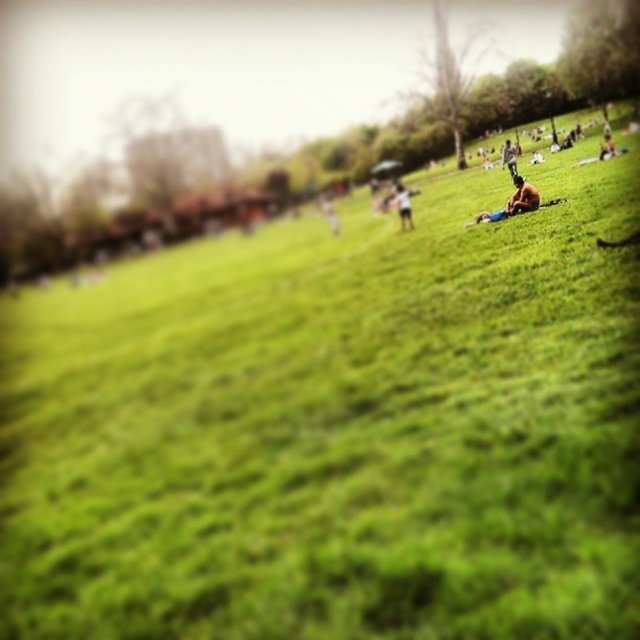
Question: Among these objects, which one is farthest from the camera?

Choices:
 (A) brown skin person at center
 (B) light blue jeans at center
 (C) smooth skin person at upper right
 (D) shiny metallic helmet at upper right

Answer: (D)

Question: Which point is farther from the camera taking this photo?

Choices:
 (A) (515, 173)
 (B) (513, 173)
 (C) (403, 188)
 (D) (522, 211)

Answer: (C)

Question: Observing the image, what is the correct spatial positioning of brown skin person at center in reference to light blue jeans at center?

Choices:
 (A) left
 (B) right

Answer: (B)

Question: Does brown textured shirt at center have a smaller size compared to brown skin person at center?

Choices:
 (A) no
 (B) yes

Answer: (A)

Question: Considering the real-world distances, which object is farthest from the light blue jeans at center?

Choices:
 (A) shiny metallic helmet at upper right
 (B) brown textured shirt at center

Answer: (A)

Question: Can you confirm if brown skin person at center is wider than light blue jeans at center?

Choices:
 (A) no
 (B) yes

Answer: (A)